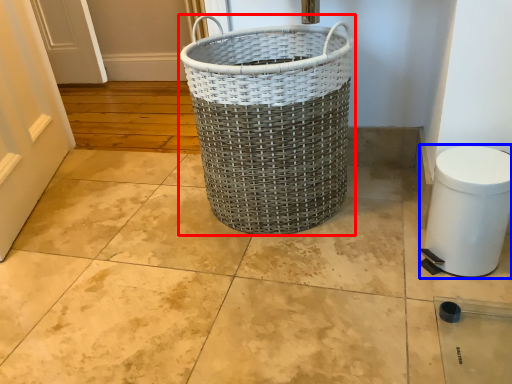
Question: Which point is further to the camera, waste container (highlighted by a red box) or gray (highlighted by a blue box)?

Choices:
 (A) waste container
 (B) gray

Answer: (A)